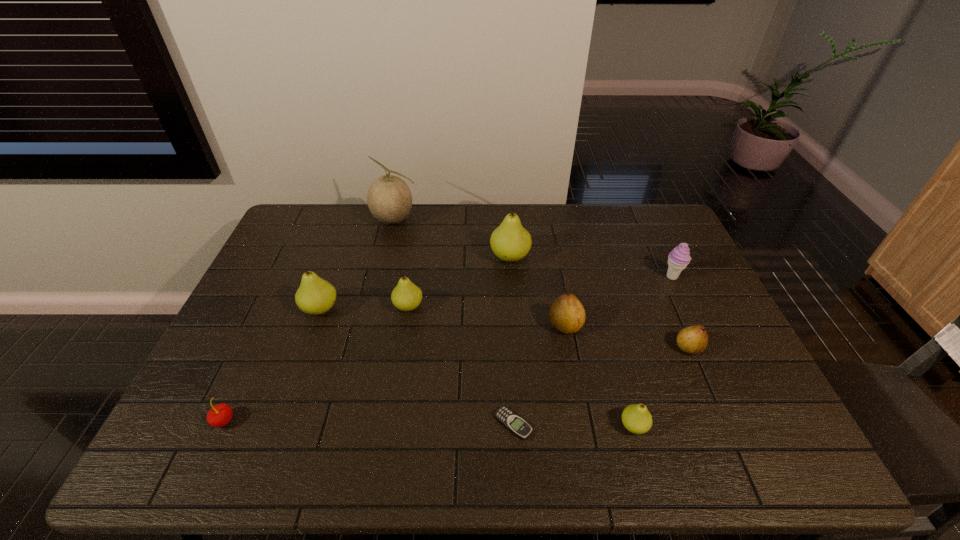
Locate an element on the screen. the smaller brown pear is located at coordinates (694, 339).

At what (x,y) coordinates should I click in order to perform the action: click on the right brown pear. Please return your answer as a coordinate pair (x, y). Looking at the image, I should click on (694, 339).

Locate an element on the screen. The width and height of the screenshot is (960, 540). the smallest green pear is located at coordinates (636, 418).

The width and height of the screenshot is (960, 540). I want to click on the nearest green pear, so point(636,418).

In order to click on cherry in this screenshot , I will do `click(221, 414)`.

Locate an element on the screen. This screenshot has width=960, height=540. red cherry is located at coordinates (221, 414).

Locate an element on the screen. the shortest object is located at coordinates (513, 422).

Image resolution: width=960 pixels, height=540 pixels. I want to click on beeper, so click(x=513, y=422).

The width and height of the screenshot is (960, 540). I want to click on vacant region located 0.350m on the front of the cantaloup, so click(x=374, y=304).

In order to click on vacant space located on the right of the second green pear from right to left in this screenshot , I will do `click(630, 257)`.